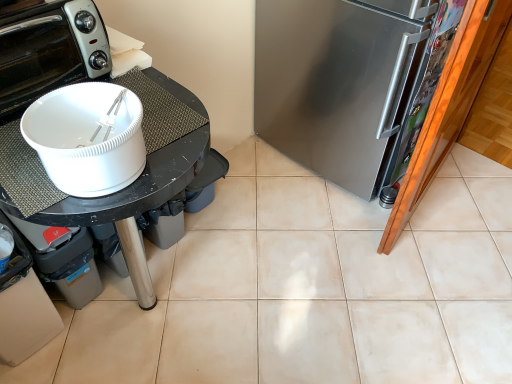
In order to face black matte table at left, should I rotate leftwards or rightwards?

You should rotate left by 18.371 degrees.

The image size is (512, 384). Find the location of `white glossy toaster oven at upper left`. white glossy toaster oven at upper left is located at coordinates (49, 50).

Find the location of a particular element. black matte table at left is located at coordinates (137, 203).

Is satin silver refrigerator at right closer to camera compared to white glossy toaster oven at upper left?

No, satin silver refrigerator at right is behind white glossy toaster oven at upper left.

Which is more to the left, satin silver refrigerator at right or white glossy toaster oven at upper left?

white glossy toaster oven at upper left is more to the left.

Is satin silver refrigerator at right bigger than white glossy toaster oven at upper left?

Yes, satin silver refrigerator at right is bigger than white glossy toaster oven at upper left.

Between satin silver refrigerator at right and white glossy toaster oven at upper left, which one has more height?

satin silver refrigerator at right is taller.

Between black matte table at left and white glossy toaster oven at upper left, which one is positioned in front?

black matte table at left is closer to the camera.

Is white glossy toaster oven at upper left at the back of black matte table at left?

black matte table at left does not have its back to white glossy toaster oven at upper left.

In the scene shown: Considering the sizes of objects black matte table at left and white glossy toaster oven at upper left in the image provided, who is smaller, black matte table at left or white glossy toaster oven at upper left?

Smaller between the two is white glossy toaster oven at upper left.

Between black matte table at left and white glossy toaster oven at upper left, which one has smaller width?

white glossy toaster oven at upper left.

Considering the positions of objects black matte table at left and satin silver refrigerator at right in the image provided, who is more to the right, black matte table at left or satin silver refrigerator at right?

satin silver refrigerator at right.

From a real-world perspective, is black matte table at left physically located above or below satin silver refrigerator at right?

black matte table at left is situated lower than satin silver refrigerator at right in the real world.

In terms of height, does black matte table at left look taller or shorter compared to satin silver refrigerator at right?

In the image, black matte table at left appears to be shorter than satin silver refrigerator at right.

Considering the relative sizes of black matte table at left and satin silver refrigerator at right in the image provided, is black matte table at left smaller than satin silver refrigerator at right?

Yes.

Considering the positions of point (47, 25) and point (153, 154), is point (47, 25) closer or farther from the camera than point (153, 154)?

Clearly, point (47, 25) is more distant from the camera than point (153, 154).

Do you think white glossy toaster oven at upper left is within black matte table at left, or outside of it?

The correct answer is: outside.

Would you say white glossy toaster oven at upper left is a long distance from black matte table at left?

white glossy toaster oven at upper left is near black matte table at left, not far away.

Considering the relative sizes of white glossy toaster oven at upper left and black matte table at left in the image provided, is white glossy toaster oven at upper left wider than black matte table at left?

No, white glossy toaster oven at upper left is not wider than black matte table at left.

Can you confirm if satin silver refrigerator at right is thinner than black matte table at left?

Yes, satin silver refrigerator at right is thinner than black matte table at left.

Is satin silver refrigerator at right in contact with black matte table at left?

No, satin silver refrigerator at right is not beside black matte table at left.

Does satin silver refrigerator at right have a lesser height compared to black matte table at left?

No, satin silver refrigerator at right is not shorter than black matte table at left.

From a real-world perspective, is satin silver refrigerator at right beneath black matte table at left?

Incorrect, from a real-world perspective, satin silver refrigerator at right is higher than black matte table at left.

From the picture: Is white glossy toaster oven at upper left facing towards satin silver refrigerator at right?

No, white glossy toaster oven at upper left does not turn towards satin silver refrigerator at right.

Would you say white glossy toaster oven at upper left is outside satin silver refrigerator at right?

Absolutely, white glossy toaster oven at upper left is external to satin silver refrigerator at right.

Considering the relative positions of white glossy toaster oven at upper left and satin silver refrigerator at right in the image provided, is white glossy toaster oven at upper left in front of satin silver refrigerator at right?

Yes, it is.

Considering the relative positions of white glossy toaster oven at upper left and satin silver refrigerator at right in the image provided, is white glossy toaster oven at upper left to the left or to the right of satin silver refrigerator at right?

white glossy toaster oven at upper left is positioned on satin silver refrigerator at right's left side.

Locate an element on the screen. The image size is (512, 384). home appliance in front of the satin silver refrigerator at right is located at coordinates (49, 50).

This screenshot has width=512, height=384. What are the coordinates of `table that appears below the white glossy toaster oven at upper left (from the image's perspective)` in the screenshot? It's located at (137, 203).

Looking at the image, which one is located closer to white glossy toaster oven at upper left, satin silver refrigerator at right or black matte table at left?

The object closer to white glossy toaster oven at upper left is black matte table at left.

Looking at the image, which one is located further to white glossy toaster oven at upper left, black matte table at left or satin silver refrigerator at right?

satin silver refrigerator at right.

Based on their spatial positions, is satin silver refrigerator at right or white glossy toaster oven at upper left further from black matte table at left?

Among the two, satin silver refrigerator at right is located further to black matte table at left.

Considering their positions, is white glossy toaster oven at upper left positioned further to black matte table at left than satin silver refrigerator at right?

Among the two, satin silver refrigerator at right is located further to black matte table at left.

Which object lies further to the anchor point satin silver refrigerator at right, black matte table at left or white glossy toaster oven at upper left?

white glossy toaster oven at upper left lies further to satin silver refrigerator at right than the other object.

Considering their positions, is white glossy toaster oven at upper left positioned further to satin silver refrigerator at right than black matte table at left?

The object further to satin silver refrigerator at right is white glossy toaster oven at upper left.

The width and height of the screenshot is (512, 384). What are the coordinates of `table between white glossy toaster oven at upper left and satin silver refrigerator at right in the horizontal direction` in the screenshot? It's located at (137, 203).